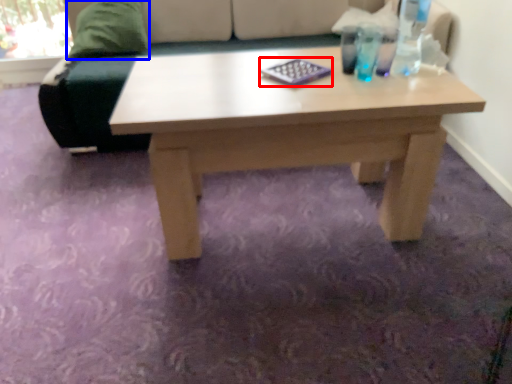
Question: Which of the following is the farthest to the observer, pad (highlighted by a red box) or pillow (highlighted by a blue box)?

Choices:
 (A) pad
 (B) pillow

Answer: (B)